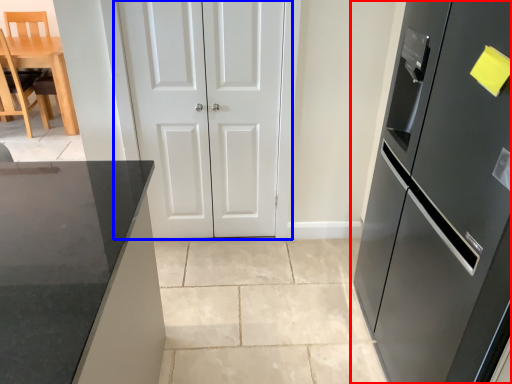
Question: Which point is further to the camera, refrigerator (highlighted by a red box) or door (highlighted by a blue box)?

Choices:
 (A) refrigerator
 (B) door

Answer: (B)